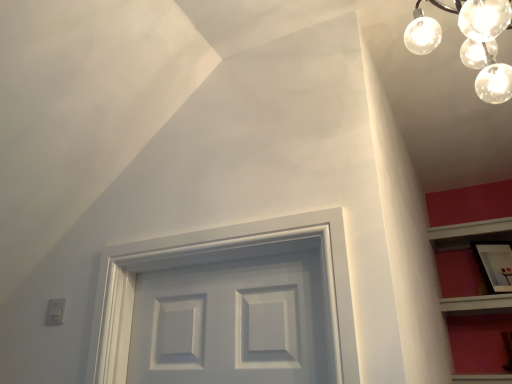
Question: Is clear glass globe at upper right inside matte black picture frame at upper right?

Choices:
 (A) yes
 (B) no

Answer: (B)

Question: Is the surface of matte black picture frame at upper right in direct contact with clear glass globe at upper right?

Choices:
 (A) no
 (B) yes

Answer: (A)

Question: Can you confirm if matte black picture frame at upper right is taller than clear glass globe at upper right?

Choices:
 (A) yes
 (B) no

Answer: (B)

Question: Does matte black picture frame at upper right have a smaller size compared to clear glass globe at upper right?

Choices:
 (A) no
 (B) yes

Answer: (B)

Question: Is matte black picture frame at upper right oriented away from clear glass globe at upper right?

Choices:
 (A) yes
 (B) no

Answer: (B)

Question: Is matte black picture frame at upper right not inside clear glass globe at upper right?

Choices:
 (A) no
 (B) yes

Answer: (B)

Question: Is clear glass globe at upper right positioned beyond the bounds of matte black picture frame at upper right?

Choices:
 (A) no
 (B) yes

Answer: (B)

Question: Does clear glass globe at upper right have a larger size compared to matte black picture frame at upper right?

Choices:
 (A) no
 (B) yes

Answer: (B)

Question: From the image's perspective, is clear glass globe at upper right below matte black picture frame at upper right?

Choices:
 (A) no
 (B) yes

Answer: (A)

Question: Could you tell me if clear glass globe at upper right is facing matte black picture frame at upper right?

Choices:
 (A) no
 (B) yes

Answer: (A)

Question: From the image's perspective, would you say clear glass globe at upper right is positioned over matte black picture frame at upper right?

Choices:
 (A) no
 (B) yes

Answer: (B)

Question: Is clear glass globe at upper right far away from matte black picture frame at upper right?

Choices:
 (A) yes
 (B) no

Answer: (A)

Question: In the image, is clear glass globe at upper right positioned in front of or behind matte black picture frame at upper right?

Choices:
 (A) behind
 (B) front

Answer: (B)